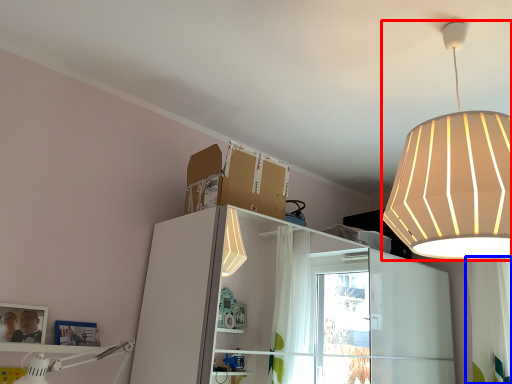
Question: Which of the following is the farthest to the observer, lamp (highlighted by a red box) or curtain (highlighted by a blue box)?

Choices:
 (A) lamp
 (B) curtain

Answer: (B)